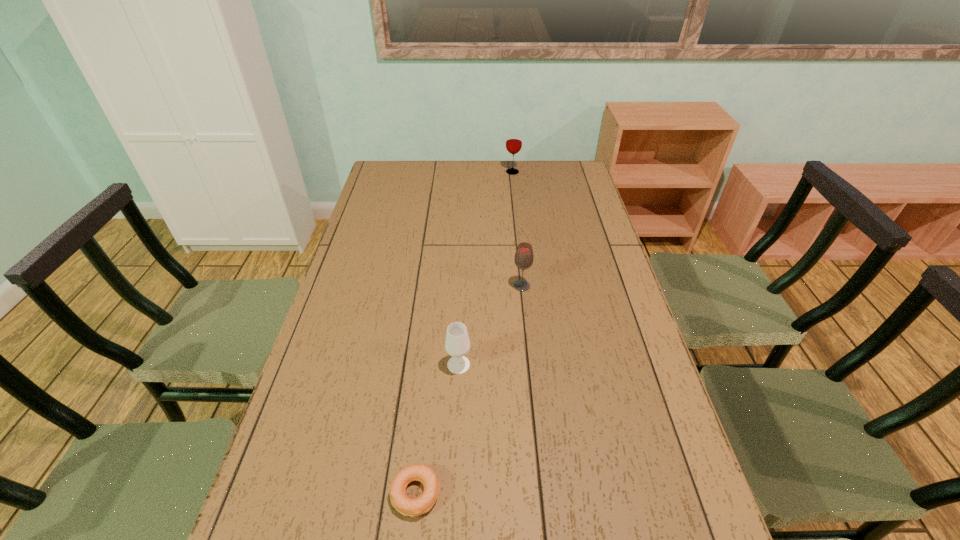
I want to click on object located in the far edge section of the desktop, so click(x=514, y=137).

You are a GUI agent. You are given a task and a screenshot of the screen. Output one action in this format:
    pyautogui.click(x=<x>, y=<y>)
    Task: Click on the vacant space at the far edge of the desktop
    
    Given the screenshot: What is the action you would take?
    pyautogui.click(x=491, y=185)

Where is `free space at the left edge of the desktop`? The height and width of the screenshot is (540, 960). free space at the left edge of the desktop is located at coordinates (330, 347).

Find the location of a particular element. The width and height of the screenshot is (960, 540). vacant space at the right edge of the desktop is located at coordinates (628, 359).

You are a GUI agent. You are given a task and a screenshot of the screen. Output one action in this format:
    pyautogui.click(x=<x>, y=<y>)
    Task: Click on the free space at the far right corner of the desktop
    This screenshot has width=960, height=540.
    Given the screenshot: What is the action you would take?
    pyautogui.click(x=565, y=163)

Locate an element on the screen. The width and height of the screenshot is (960, 540). vacant area that lies between the second nearest object and the second farthest glass is located at coordinates (491, 326).

In order to click on empty space between the leftmost glass and the bagel in this screenshot , I will do `click(437, 429)`.

Locate an element on the screen. The width and height of the screenshot is (960, 540). free area in between the nearest object and the leftmost glass is located at coordinates (437, 429).

Where is `empty space between the leftmost glass and the third nearest object`? The height and width of the screenshot is (540, 960). empty space between the leftmost glass and the third nearest object is located at coordinates (491, 326).

At what (x,y) coordinates should I click in order to perform the action: click on vacant area that lies between the third farthest object and the farthest object. Please return your answer as a coordinate pair (x, y). The width and height of the screenshot is (960, 540). Looking at the image, I should click on (486, 268).